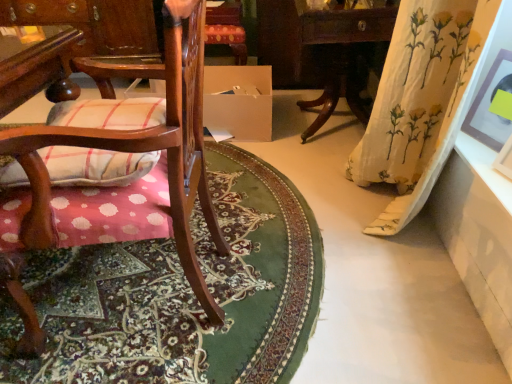
Question: From a real-world perspective, is wooden chair with cushion at left positioned above or below plaid fabric cushion at left?

Choices:
 (A) below
 (B) above

Answer: (A)

Question: Is point click(x=74, y=200) closer or farther from the camera than point click(x=135, y=160)?

Choices:
 (A) farther
 (B) closer

Answer: (A)

Question: Considering the real-world distances, which object is closest to the white floral fabric curtain at right?

Choices:
 (A) matte brown picture frame at upper right
 (B) plaid fabric cushion at left
 (C) carpeted floor mat at lower left
 (D) wooden table at right, the second table from the right
 (E) wooden chair with cushion at left

Answer: (A)

Question: Which of these objects is positioned closest to the wooden table at left, which is the first table from back to front?

Choices:
 (A) white floral fabric curtain at right
 (B) wooden chair with cushion at left
 (C) carpeted floor mat at lower left
 (D) matte brown picture frame at upper right
 (E) white cardboard box at center

Answer: (E)